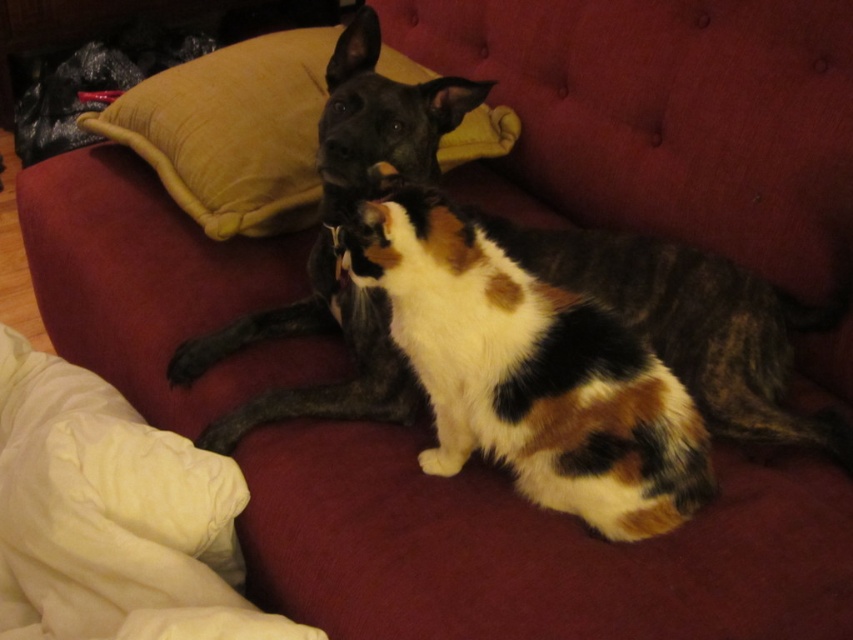
You are an animal behaviorist observing the scene. The calico fur cat at center is positioned at coordinates 0.583 on the x axis and 0.621 on the y axis. If you were to draw a straight line from the cat to the edge of the couch, which direction would the line point towards?

The line would point towards the lower right direction since the cat is located at coordinates 0.583 on the x axis and 0.621 on the y axis.

Looking at this image, you are a photographer setting up a shot of the calico fur cat at center and the velvet yellow pillow at upper center. You need to ensure both subjects are in focus. Given that the cat is smaller than the pillow, which subject should you adjust your focus on first to account for their size difference?

The calico fur cat at center is smaller compared to the velvet yellow pillow at upper center. To ensure both are in focus, start focusing on the smaller subject, the calico fur cat at center, then adjust to include the larger pillow.